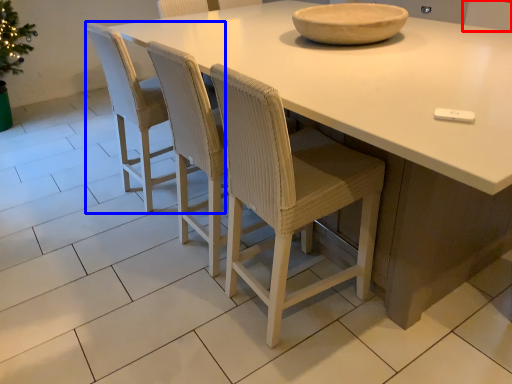
Question: Which object appears closest to the camera in this image, chair (highlighted by a red box) or chair (highlighted by a blue box)?

Choices:
 (A) chair
 (B) chair

Answer: (B)